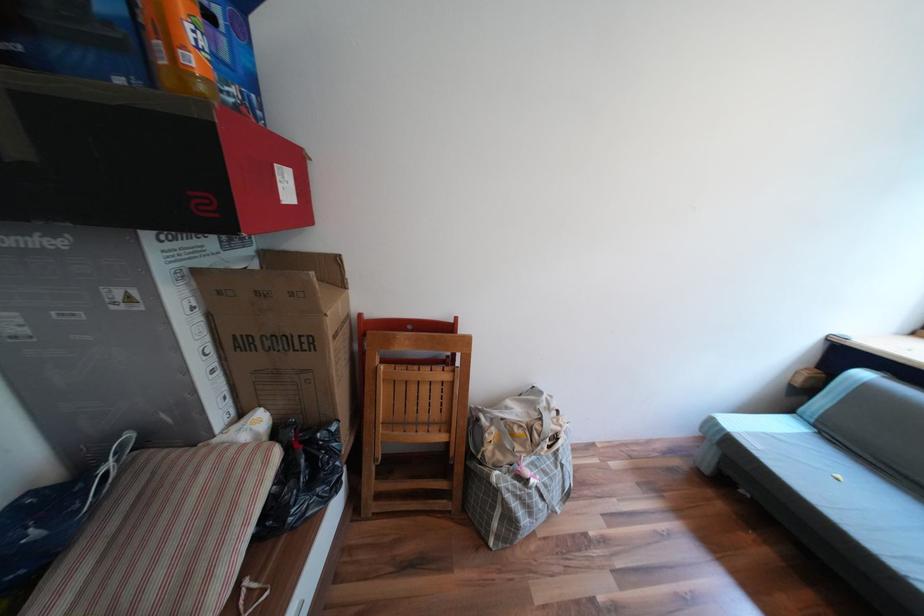
You are a GUI agent. You are given a task and a screenshot of the screen. Output one action in this format:
    pyautogui.click(x=<x>, y=<y>)
    Task: Click on the sofa sitting surface
    The width and height of the screenshot is (924, 616).
    Given the screenshot: What is the action you would take?
    pyautogui.click(x=825, y=503)